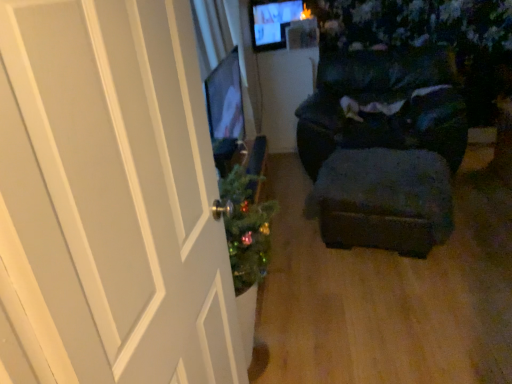
The height and width of the screenshot is (384, 512). I want to click on vacant space situated on the left part of velvet dark blue stool at center, so click(x=300, y=254).